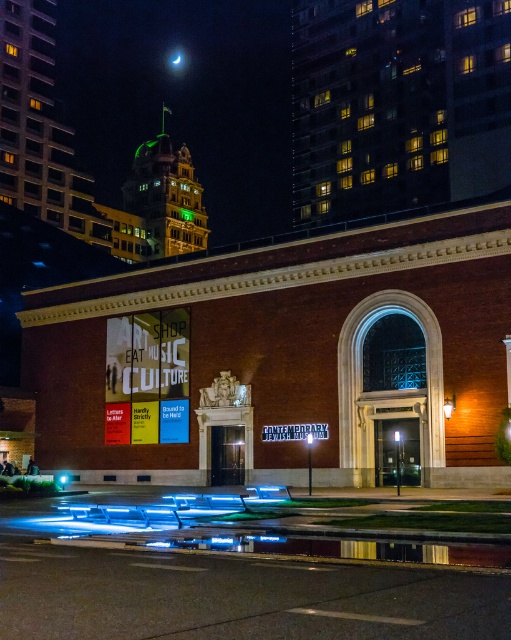
You are standing in front of the Contemporary Jewish Museum at night. You see two points marked on the building facade. The first point is at coordinates point (192, 312) and the second point is at coordinates point (405, 205). Which of these points is closer to you?

Point (192, 312) is in front of point (405, 205), so it is closer to you.

You are a visitor trying to find the entrance to the Contemporary Jewish Museum. You see the matte glass sign at center and the brick building at upper right. Which object is closer to the entrance?

The matte glass sign at center is closer to the entrance because it is positioned at the center, while the brick building at upper right is located further away.